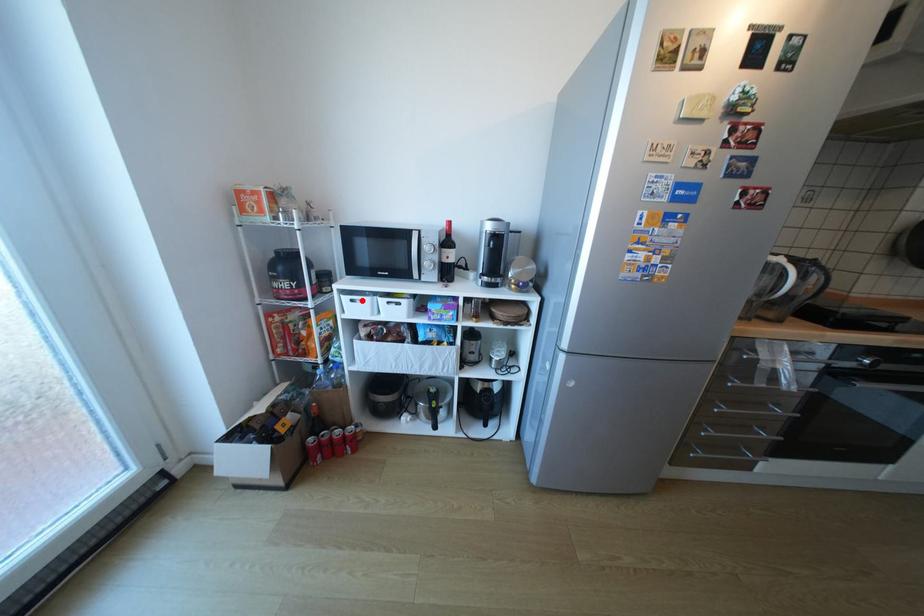
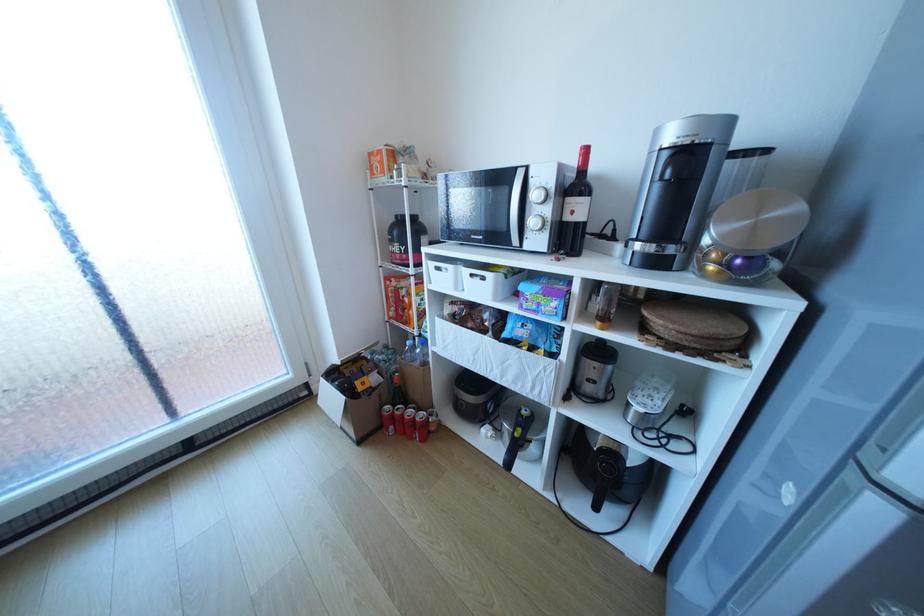
Where in the second image is the point corresponding to the highlighted location from the first image?

(446, 268)